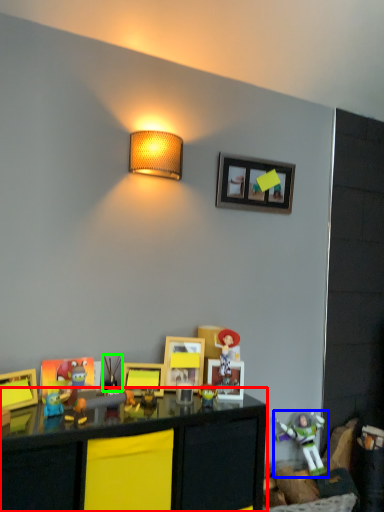
Question: Which is farther away from table (highlighted by a red box)? toy (highlighted by a blue box) or toy (highlighted by a green box)?

Choices:
 (A) toy
 (B) toy

Answer: (A)